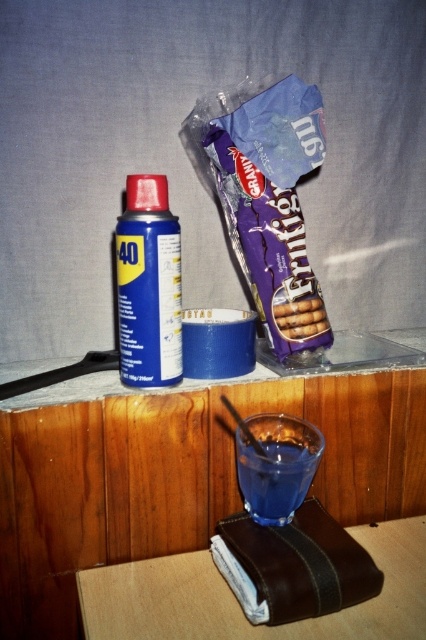
Question: Which point is farther from the camera taking this photo?

Choices:
 (A) (158, 602)
 (B) (252, 472)

Answer: (B)

Question: Is blue matte spray can at center below brown crumbly cookies at center?

Choices:
 (A) no
 (B) yes

Answer: (A)

Question: Can you confirm if matte purple chocolate bar at center is positioned above brown crumbly cookies at center?

Choices:
 (A) no
 (B) yes

Answer: (A)

Question: Which object is closer to the camera taking this photo?

Choices:
 (A) blue matte spray can at center
 (B) matte purple chocolate bar at center
 (C) brown crumbly cookies at center

Answer: (B)

Question: Among these points, which one is farthest from the camera?

Choices:
 (A) coord(296,312)
 (B) coord(150,312)
 (C) coord(313,564)
 (D) coord(408,637)

Answer: (A)

Question: Where is transparent glass at lower center located in relation to brown crumbly cookies at center in the image?

Choices:
 (A) left
 (B) right

Answer: (A)